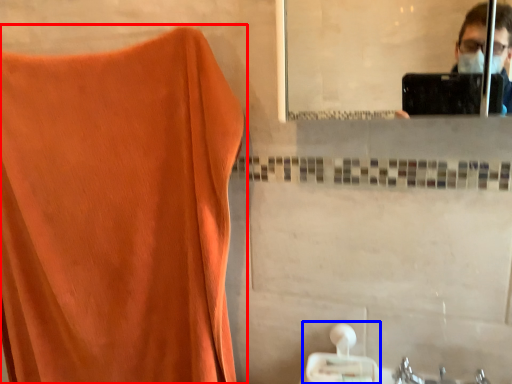
Question: Which object appears closest to the camera in this image, curtain (highlighted by a red box) or tissue (highlighted by a blue box)?

Choices:
 (A) curtain
 (B) tissue

Answer: (A)